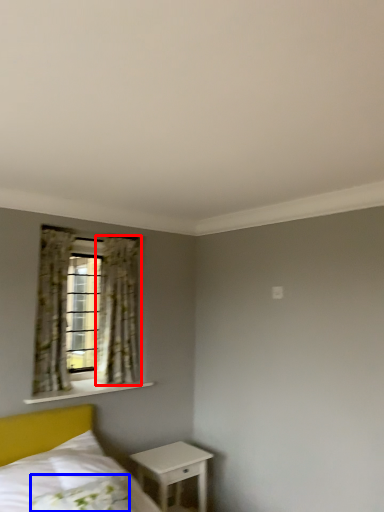
Question: Which point is further to the camera, curtain (highlighted by a red box) or pillow (highlighted by a blue box)?

Choices:
 (A) curtain
 (B) pillow

Answer: (A)